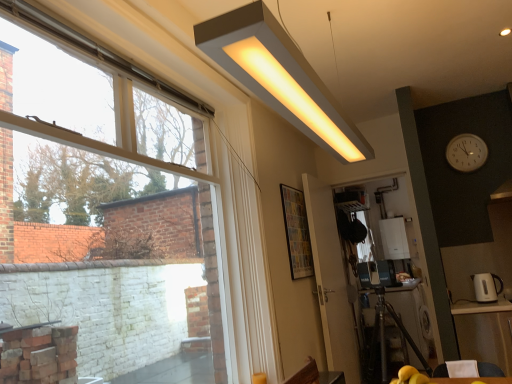
You are a GUI agent. You are given a task and a screenshot of the screen. Output one action in this format:
    pyautogui.click(x=<x>, y=<y>)
    Task: Click on the blank space situated above transparent glass window at upper left (from a real-world perspective)
    
    Given the screenshot: What is the action you would take?
    pyautogui.click(x=149, y=43)